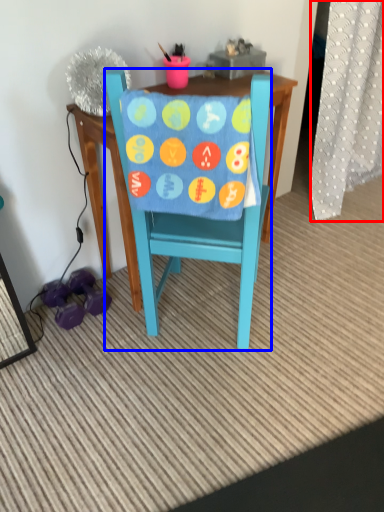
Question: Which object is closer to the camera taking this photo, curtain (highlighted by a red box) or chair (highlighted by a blue box)?

Choices:
 (A) curtain
 (B) chair

Answer: (B)